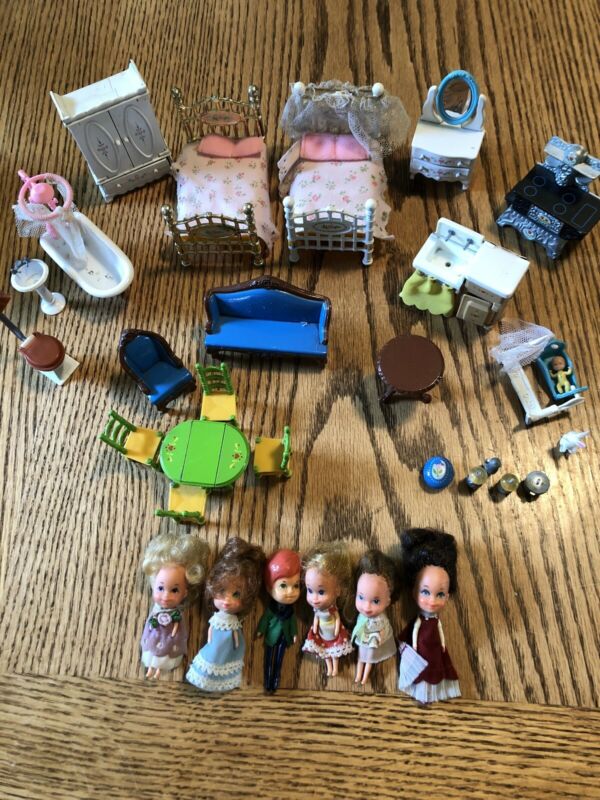
This screenshot has width=600, height=800. Find the location of `dolls`. dolls is located at coordinates (159, 624), (205, 634), (272, 625), (320, 624), (426, 632), (566, 376).